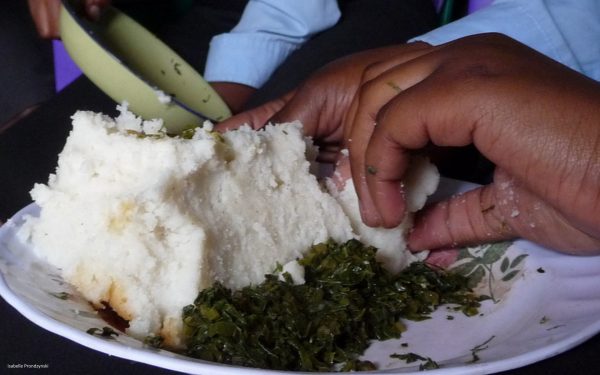
Where is `black table`? This screenshot has width=600, height=375. black table is located at coordinates pos(24,345).